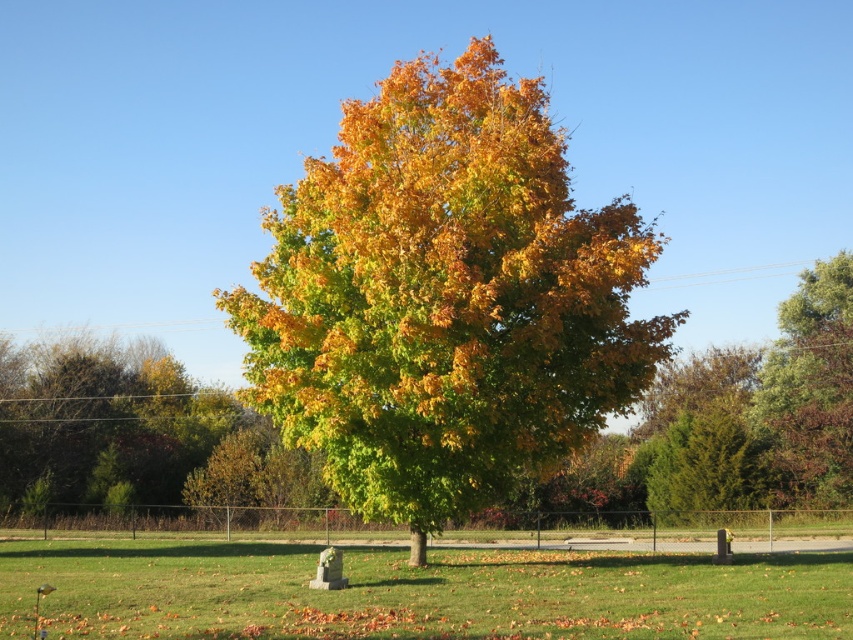
Question: Observing the image, what is the correct spatial positioning of yellow-green foliage at center in reference to green matte tree at right?

Choices:
 (A) below
 (B) above

Answer: (B)

Question: Which of these objects is positioned farthest from the yellow-green foliage at center?

Choices:
 (A) green grass at center
 (B) green matte tree at right

Answer: (B)

Question: Which point is closer to the camera taking this photo?

Choices:
 (A) (850, 433)
 (B) (415, 630)

Answer: (B)

Question: Can you confirm if yellow-green foliage at center is smaller than green grass at center?

Choices:
 (A) yes
 (B) no

Answer: (B)

Question: Is yellow-green foliage at center smaller than green matte tree at right?

Choices:
 (A) yes
 (B) no

Answer: (B)

Question: Which object appears farthest from the camera in this image?

Choices:
 (A) yellow-green foliage at center
 (B) green matte tree at right
 (C) green grass at center

Answer: (B)